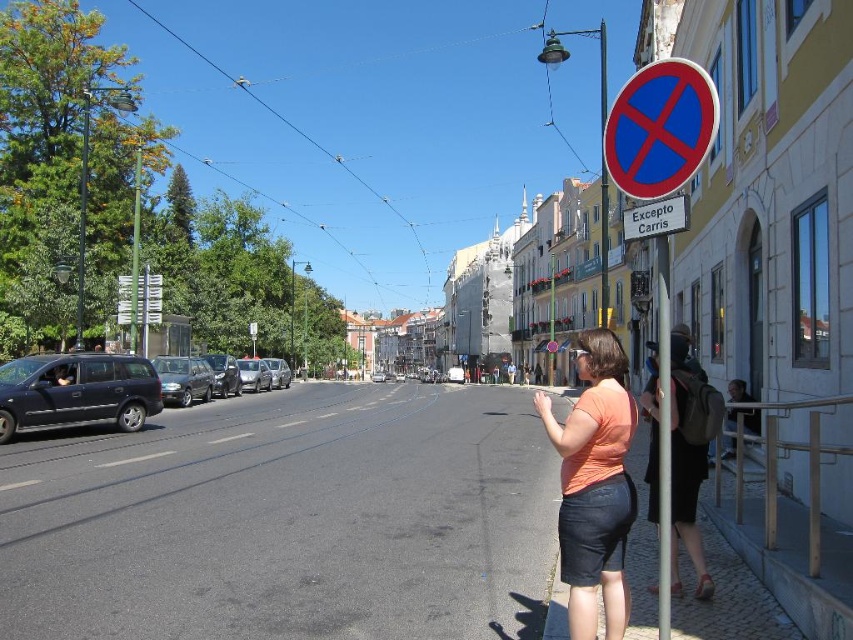
Question: Does paved asphalt at lower center appear over metallic gray minivan at left?

Choices:
 (A) no
 (B) yes

Answer: (A)

Question: Estimate the real-world distances between objects in this image. Which object is closer to the silver metallic car at center?

Choices:
 (A) metallic pole at right
 (B) shiny black car at center-left
 (C) matte black van at left

Answer: (B)

Question: Does blue plastic sign at upper right lie in front of silver metallic car at center-left?

Choices:
 (A) no
 (B) yes

Answer: (B)

Question: Among these points, which one is farthest from the camera?

Choices:
 (A) (753, 608)
 (B) (230, 388)
 (C) (624, 225)
 (D) (582, 541)

Answer: (B)

Question: Which of the following is the farthest from the observer?

Choices:
 (A) (265, 372)
 (B) (570, 428)
 (C) (195, 376)

Answer: (A)

Question: Does paved asphalt at lower center appear on the right side of blue plastic sign at upper right?

Choices:
 (A) yes
 (B) no

Answer: (B)